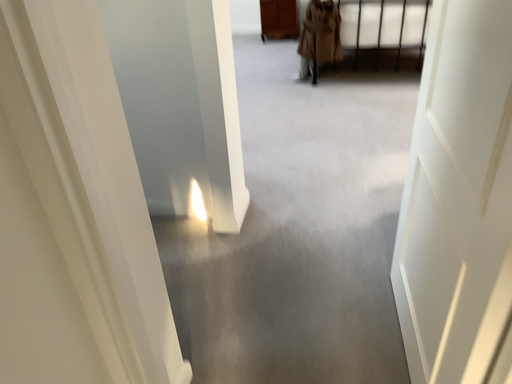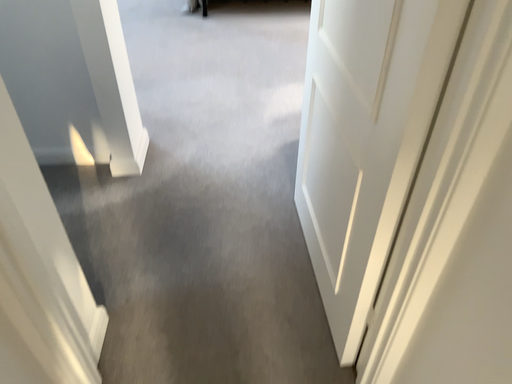
Question: How did the camera likely rotate when shooting the video?

Choices:
 (A) rotated upward
 (B) rotated downward

Answer: (B)